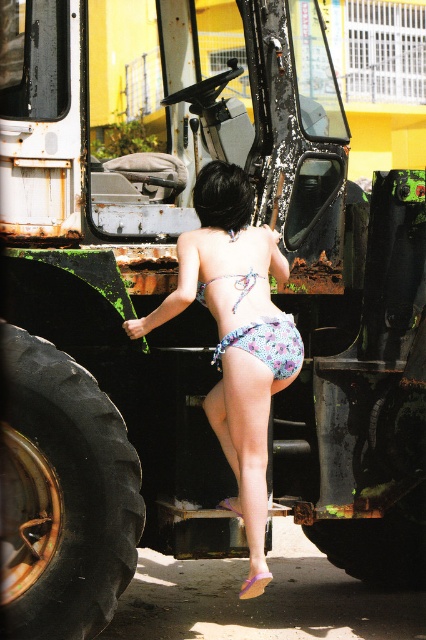
Question: Which is farther from the floral fabric bikini at center?

Choices:
 (A) black rubber tire at lower left
 (B) floral print fabric bikini bottom at center
 (C) translucent floral bikini top at center

Answer: (A)

Question: Is black rubber tire at lower left behind floral print fabric bikini bottom at center?

Choices:
 (A) no
 (B) yes

Answer: (A)

Question: Among these points, which one is nearest to the camera?

Choices:
 (A) (193, 259)
 (B) (86, 476)

Answer: (B)

Question: Can you confirm if floral fabric bikini at center is positioned above translucent floral bikini top at center?

Choices:
 (A) yes
 (B) no

Answer: (B)

Question: Which point is closer to the camera?

Choices:
 (A) (290, 371)
 (B) (78, 557)
 (C) (267, 355)
 (D) (204, 296)

Answer: (B)

Question: Is floral fabric bikini at center bigger than translucent floral bikini top at center?

Choices:
 (A) yes
 (B) no

Answer: (A)